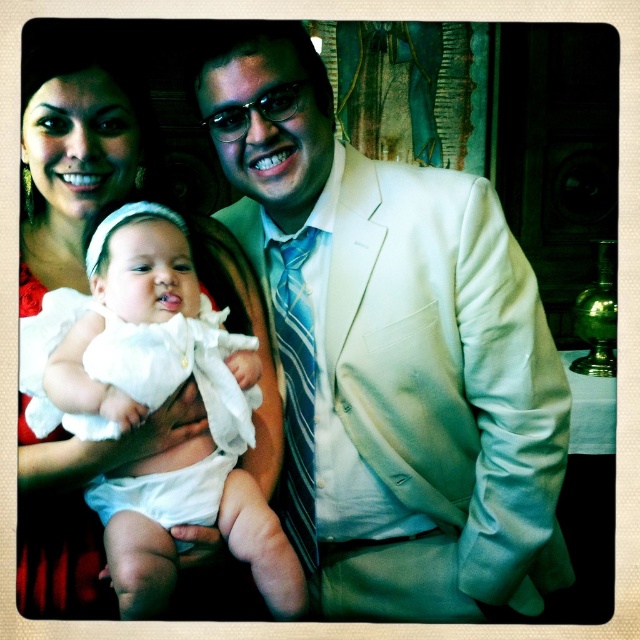
Can you confirm if white clothed baby at center is positioned below blue striped tie at center?

No.

The width and height of the screenshot is (640, 640). I want to click on white clothed baby at center, so click(x=192, y=522).

Which is in front, point (170, 589) or point (298, 467)?

Point (170, 589) is in front.

Where is `white clothed baby at center`? white clothed baby at center is located at coordinates (192, 522).

Is point (74, 346) positioned before point (33, 604)?

That is True.

Between white clothed baby at center and white satin dress at center, which one has less height?

With less height is white satin dress at center.

Is point (140, 554) farther from viewer compared to point (22, 420)?

No, it is not.

Identify the location of white clothed baby at center. (192, 522).

Does white satin suit at center have a smaller size compared to white clothed baby at center?

Actually, white satin suit at center might be larger than white clothed baby at center.

Is white satin suit at center to the left of white clothed baby at center from the viewer's perspective?

Incorrect, white satin suit at center is not on the left side of white clothed baby at center.

Which is in front, point (364, 509) or point (118, 602)?

Point (118, 602) is more forward.

This screenshot has height=640, width=640. Find the location of `white satin suit at center`. white satin suit at center is located at coordinates (390, 353).